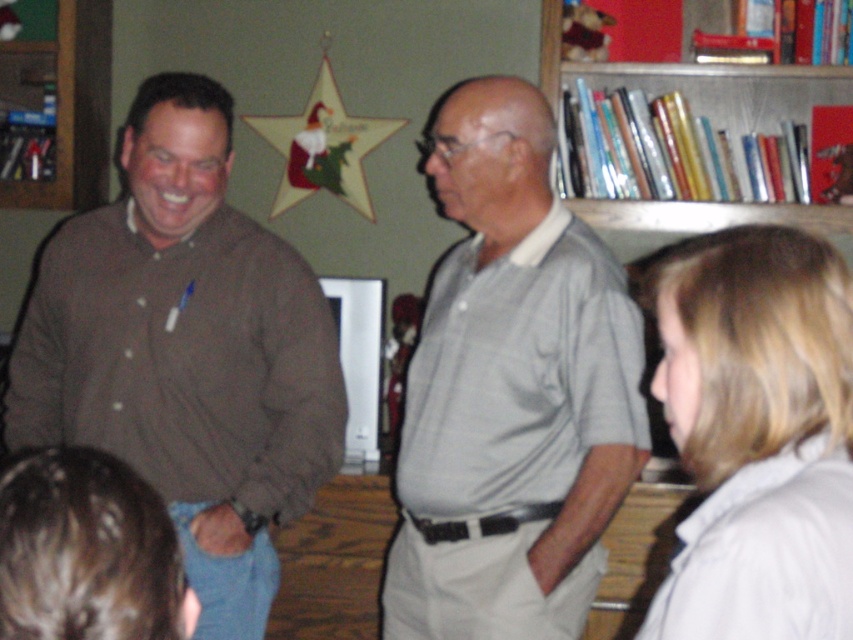
In the scene, there are two people visible. The first is wearing a brown cotton shirt at left, and the second has blonde hair at lower right. From the perspective of someone standing in the room, which of these two people is positioned more to the left side of the scene?

The brown cotton shirt at left is positioned more to the left side of the scene compared to the blonde hair at lower right.

From the picture: You are standing in the living room and see two points marked in the image. Which point is closer to you, point (x=248, y=394) or point (x=689, y=531)?

Point (x=248, y=394) is closer to you than point (x=689, y=531).